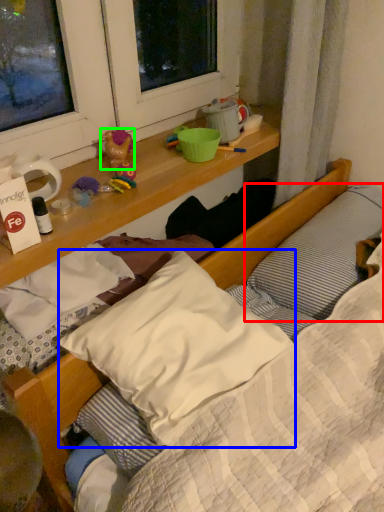
Question: Estimate the real-world distances between objects in this image. Which object is farther from pillow (highlighted by a red box), pillow (highlighted by a blue box) or toy (highlighted by a green box)?

Choices:
 (A) pillow
 (B) toy

Answer: (B)